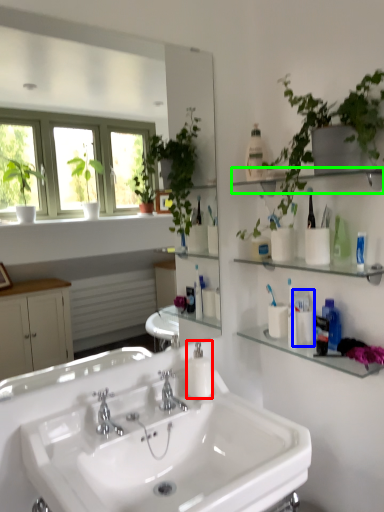
Question: Which is nearer to the soap dispenser (highlighted by a red box)? toiletry (highlighted by a blue box) or shelf (highlighted by a green box).

Choices:
 (A) toiletry
 (B) shelf

Answer: (A)